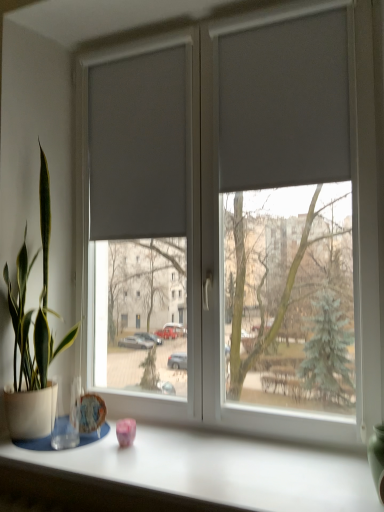
Question: Is matte gray curtain at upper right, the first curtain viewed from the right, positioned in front of green matte glass vase at right?

Choices:
 (A) no
 (B) yes

Answer: (A)

Question: Is matte gray curtain at upper right, positioned as the 1th curtain in front-to-back order, next to green matte glass vase at right?

Choices:
 (A) no
 (B) yes

Answer: (A)

Question: Is matte gray curtain at upper right, the first curtain viewed from the right, bigger than green matte glass vase at right?

Choices:
 (A) yes
 (B) no

Answer: (A)

Question: Does matte gray curtain at upper right, positioned as the 1th curtain in front-to-back order, have a greater width compared to green matte glass vase at right?

Choices:
 (A) yes
 (B) no

Answer: (B)

Question: From a real-world perspective, is matte gray curtain at upper right, which is the 2th curtain in back-to-front order, under green matte glass vase at right?

Choices:
 (A) no
 (B) yes

Answer: (A)

Question: Is matte gray curtain at upper right, marked as the 2th curtain in a left-to-right arrangement, looking in the opposite direction of green matte glass vase at right?

Choices:
 (A) no
 (B) yes

Answer: (A)

Question: Can you confirm if matte gray curtain at upper right, the first curtain viewed from the right, is smaller than white matte table at lower center?

Choices:
 (A) yes
 (B) no

Answer: (A)

Question: Is the position of matte gray curtain at upper right, positioned as the 1th curtain in front-to-back order, more distant than that of white matte table at lower center?

Choices:
 (A) yes
 (B) no

Answer: (A)

Question: Does matte gray curtain at upper right, positioned as the 1th curtain in front-to-back order, have a lesser width compared to white matte table at lower center?

Choices:
 (A) yes
 (B) no

Answer: (A)

Question: Is matte gray curtain at upper right, marked as the 2th curtain in a left-to-right arrangement, next to white matte table at lower center and touching it?

Choices:
 (A) yes
 (B) no

Answer: (B)

Question: Can you confirm if matte gray curtain at upper right, positioned as the 1th curtain in front-to-back order, is bigger than white matte table at lower center?

Choices:
 (A) no
 (B) yes

Answer: (A)

Question: From the image's perspective, would you say matte gray curtain at upper right, positioned as the 1th curtain in front-to-back order, is positioned over white matte table at lower center?

Choices:
 (A) no
 (B) yes

Answer: (B)

Question: Is matte gray blinds at center positioned far away from white matte table at lower center?

Choices:
 (A) no
 (B) yes

Answer: (A)